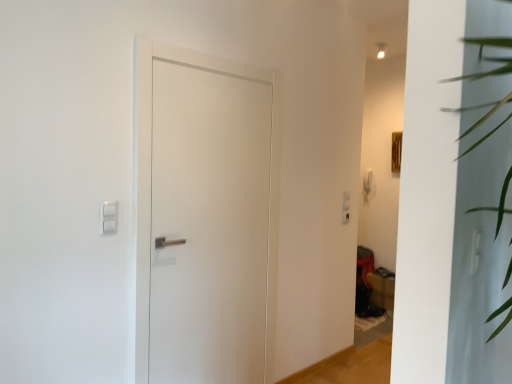
What is the approximate width of white plastic light switch at upper left?

The width of white plastic light switch at upper left is 0.83 inches.

Find the location of a particular element. white plastic light switch at upper left is located at coordinates (108, 217).

In order to face white matte door at center, should I rotate leftwards or rightwards?

A 4.886 degree turn to the left will do.

Find the location of `white matte door at center`. white matte door at center is located at coordinates (150, 177).

Locate an element on the screen. The width and height of the screenshot is (512, 384). white plastic light switch at upper left is located at coordinates (108, 217).

In the scene shown: Is white plastic light switch at upper left far from white matte door at center?

No, there isn't a large distance between white plastic light switch at upper left and white matte door at center.

Based on the photo, considering the sizes of white plastic light switch at upper left and white matte door at center in the image, is white plastic light switch at upper left bigger or smaller than white matte door at center?

white plastic light switch at upper left is smaller than white matte door at center.

From the image's perspective, between white plastic light switch at upper left and white matte door at center, which one is located above?

white plastic light switch at upper left appears higher in the image.

Is white plastic light switch at upper left facing towards white matte door at center?

No, white plastic light switch at upper left is not aimed at white matte door at center.

Between white matte door at center and white plastic light switch at upper left, which one appears on the left side from the viewer's perspective?

white plastic light switch at upper left is more to the left.

From the image's perspective, which one is positioned lower, white matte door at center or white plastic light switch at upper left?

white matte door at center is shown below in the image.

Considering the points (145, 378) and (109, 232), which point is behind, point (145, 378) or point (109, 232)?

The point (145, 378) is more distant.

What's the angular difference between white matte door at center and white plastic light switch at upper left's facing directions?

1.84 degrees separate the facing orientations of white matte door at center and white plastic light switch at upper left.

Is white matte door at center thinner than matte brown cardboard box at lower right?

Yes.

Could you tell me if white matte door at center is turned towards matte brown cardboard box at lower right?

No, white matte door at center does not turn towards matte brown cardboard box at lower right.

Is white matte door at center far away from matte brown cardboard box at lower right?

Indeed, white matte door at center is not near matte brown cardboard box at lower right.

Looking at this image, how different are the orientations of white matte door at center and matte brown cardboard box at lower right in degrees?

90.1 degrees.

Is white plastic light switch at upper left aimed at matte brown cardboard box at lower right?

No.

Considering the positions of objects white plastic light switch at upper left and matte brown cardboard box at lower right in the image provided, who is behind, white plastic light switch at upper left or matte brown cardboard box at lower right?

matte brown cardboard box at lower right is further from the camera.

Are white plastic light switch at upper left and matte brown cardboard box at lower right located far from each other?

Absolutely, white plastic light switch at upper left is distant from matte brown cardboard box at lower right.

Consider the image. Between matte brown cardboard box at lower right and white matte door at center, which one has less height?

Standing shorter between the two is matte brown cardboard box at lower right.

Is there a large distance between matte brown cardboard box at lower right and white matte door at center?

Yes, matte brown cardboard box at lower right and white matte door at center are quite far apart.

Which object is positioned more to the left, matte brown cardboard box at lower right or white matte door at center?

From the viewer's perspective, white matte door at center appears more on the left side.

Locate an element on the screen. This screenshot has height=384, width=512. door above the matte brown cardboard box at lower right (from a real-world perspective) is located at coordinates click(150, 177).

At what (x,y) coordinates should I click in order to perform the action: click on light switch above the matte brown cardboard box at lower right (from a real-world perspective). Please return your answer as a coordinate pair (x, y). The height and width of the screenshot is (384, 512). Looking at the image, I should click on (108, 217).

From a real-world perspective, which object rests below the other?

matte brown cardboard box at lower right, from a real-world perspective.

Which of these two, matte brown cardboard box at lower right or white plastic light switch at upper left, is bigger?

Bigger between the two is matte brown cardboard box at lower right.

The height and width of the screenshot is (384, 512). What are the coordinates of `door below the white plastic light switch at upper left (from the image's perspective)` in the screenshot? It's located at (150, 177).

This screenshot has height=384, width=512. Identify the location of light switch that appears on the left of white matte door at center. click(108, 217).

Looking at the image, which one is located further to matte brown cardboard box at lower right, white matte door at center or white plastic light switch at upper left?

The object further to matte brown cardboard box at lower right is white plastic light switch at upper left.

Estimate the real-world distances between objects in this image. Which object is closer to white matte door at center, white plastic light switch at upper left or matte brown cardboard box at lower right?

white plastic light switch at upper left is closer to white matte door at center.

Which object lies nearer to the anchor point white matte door at center, matte brown cardboard box at lower right or white plastic light switch at upper left?

white plastic light switch at upper left is closer to white matte door at center.

From the picture: Based on their spatial positions, is white matte door at center or matte brown cardboard box at lower right closer to white plastic light switch at upper left?

white matte door at center is positioned closer to the anchor white plastic light switch at upper left.

Which object lies nearer to the anchor point matte brown cardboard box at lower right, white plastic light switch at upper left or white matte door at center?

white matte door at center lies closer to matte brown cardboard box at lower right than the other object.

Considering their positions, is matte brown cardboard box at lower right positioned closer to white plastic light switch at upper left than white matte door at center?

white matte door at center.

Where is `door between white plastic light switch at upper left and matte brown cardboard box at lower right from front to back`? door between white plastic light switch at upper left and matte brown cardboard box at lower right from front to back is located at coordinates (150, 177).